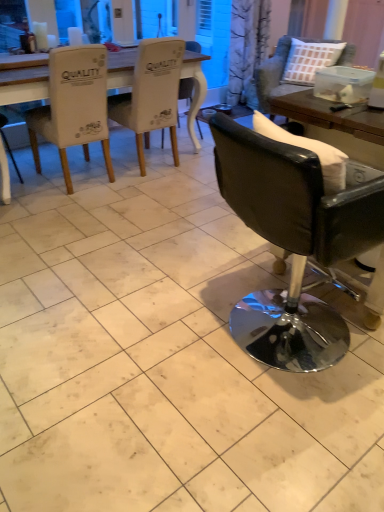
I want to click on vacant space to the left of black leather chair at right, acting as the 2th chair starting from the right, so click(149, 337).